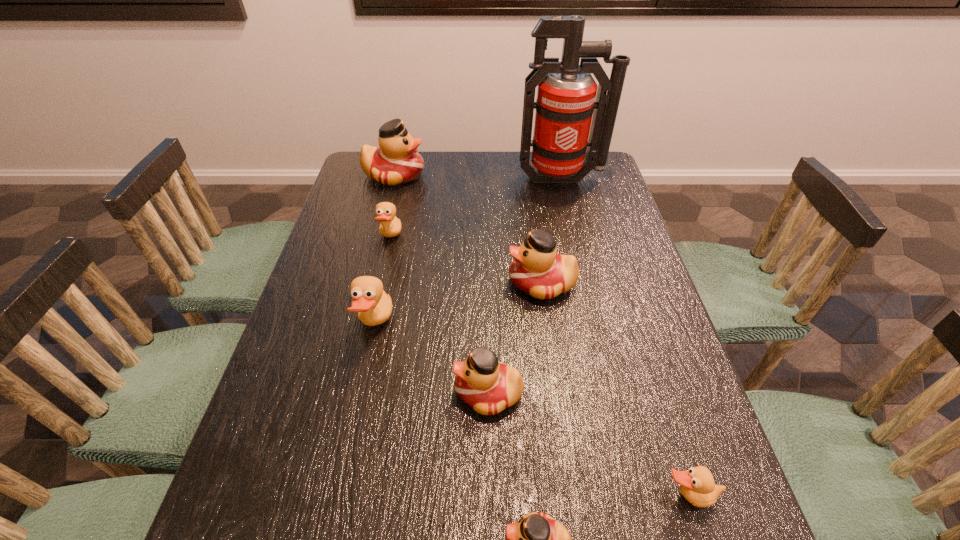
Where is `the rightmost tan duck`? Image resolution: width=960 pixels, height=540 pixels. the rightmost tan duck is located at coordinates 697,485.

At what (x,y) coordinates should I click in order to perform the action: click on the sixth farthest duck. Please return your answer as a coordinate pair (x, y). The image size is (960, 540). Looking at the image, I should click on (697, 485).

Where is `free space located on the front label side of the tallest object`? The image size is (960, 540). free space located on the front label side of the tallest object is located at coordinates (574, 232).

Locate an element on the screen. vacant space located 0.170m on the face of the farthest duck is located at coordinates (474, 176).

The width and height of the screenshot is (960, 540). In order to click on vacant area situated on the face of the second biggest red duck in this screenshot , I will do `click(420, 284)`.

The width and height of the screenshot is (960, 540). I want to click on free region located on the face of the second biggest red duck, so click(409, 284).

At what (x,y) coordinates should I click in order to perform the action: click on free region located 0.120m on the face of the second biggest red duck. Please return your answer as a coordinate pair (x, y). Looking at the image, I should click on (462, 284).

Where is `free space located on the beak of the biggest tan duck`? free space located on the beak of the biggest tan duck is located at coordinates (467, 326).

Find the location of a particular element. This screenshot has width=960, height=540. vacant region located on the face of the third biggest red duck is located at coordinates (336, 393).

Locate an element on the screen. The image size is (960, 540). vacant space located 0.160m on the face of the third biggest red duck is located at coordinates (379, 393).